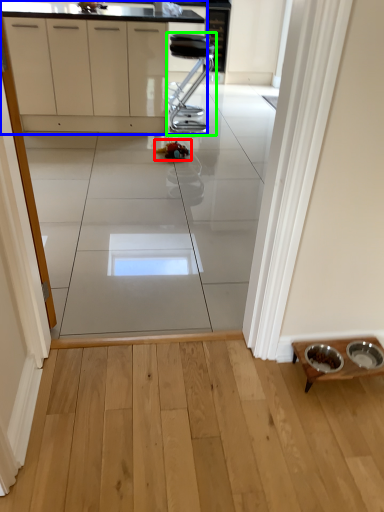
Question: Which object is positioned farthest from toy (highlighted by a red box)? Select from cabinetry (highlighted by a blue box) and furniture (highlighted by a green box).

Choices:
 (A) cabinetry
 (B) furniture

Answer: (A)